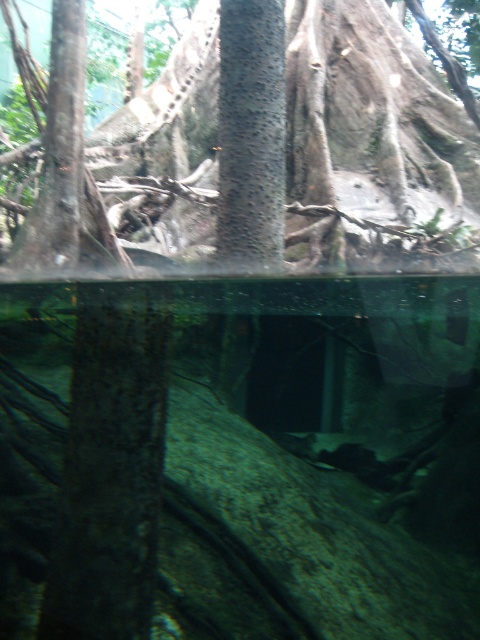
Does green translucent water at center appear under rough bark tree at center?

Indeed, green translucent water at center is positioned under rough bark tree at center.

Consider the image. Between green translucent water at center and rough bark tree at center, which one is positioned lower?

green translucent water at center

I want to click on green translucent water at center, so click(241, 456).

Between rough bark tree at center and rough bark tree trunk at center, which one has less height?

With less height is rough bark tree trunk at center.

From the picture: Which is below, rough bark tree at center or rough bark tree trunk at center?

rough bark tree trunk at center is below.

What do you see at coordinates (372, 145) in the screenshot? I see `rough bark tree at center` at bounding box center [372, 145].

Locate an element on the screen. rough bark tree at center is located at coordinates (372, 145).

Looking at this image, between green translucent water at center and dark brown rough tree trunk at center, which one appears on the left side from the viewer's perspective?

From the viewer's perspective, dark brown rough tree trunk at center appears more on the left side.

Does point (324, 420) come in front of point (85, 600)?

No, (324, 420) is behind (85, 600).

Does point (0, 323) lie behind point (109, 499)?

Yes, it is.

Identify the location of green translucent water at center. (241, 456).